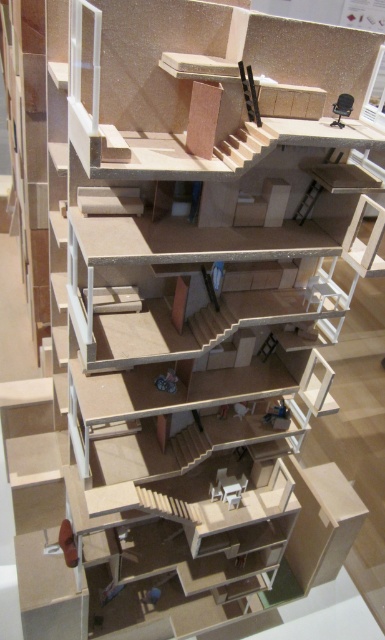
You are a maintenance worker needing to move a 4 feet long tool from the wooden stairs at upper center to the wooden staircase at center. Can you move it horizontally without tilting the tool?

The distance between the wooden stairs at upper center and wooden staircase at center is 3.73 feet, which is shorter than the tool length of 4 feet. Therefore, the tool cannot be moved horizontally without tilting.

You are a maintenance worker standing at the base of the wooden stairs at upper center. You need to reach a tool box placed exactly 5 feet away from where you are standing. Can you reach the tool box without moving from your current position?

The wooden stairs at upper center and viewer are 4.85 feet apart from each other. Since the tool box is placed 5 feet away, which is slightly farther than the 4.85 feet distance, you cannot reach it without moving.